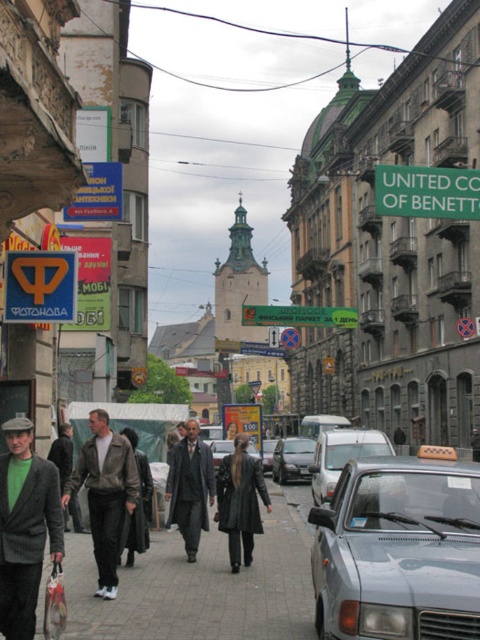
Question: Which object appears closest to the camera in this image?

Choices:
 (A) dark gray leather coat at center
 (B) paved stone sidewalk at center
 (C) silver metallic sedan at center
 (D) metallic gray taxi at center

Answer: (D)

Question: Among these points, which one is nearest to the camera?

Choices:
 (A) (465, 204)
 (B) (252, 445)
 (C) (351, 628)

Answer: (C)

Question: Does green plastic signboard at upper right have a lesser width compared to metallic silver car at center?

Choices:
 (A) no
 (B) yes

Answer: (A)

Question: Which point is farther to the camera?

Choices:
 (A) dark gray leather coat at center
 (B) metallic gray sedan at center
 (C) metallic silver car at center

Answer: (C)

Question: Can you confirm if dark gray wool coat at center is positioned above metallic silver car at center?

Choices:
 (A) no
 (B) yes

Answer: (B)

Question: Does leather jacket at center appear under metallic gray sedan at center?

Choices:
 (A) no
 (B) yes

Answer: (A)